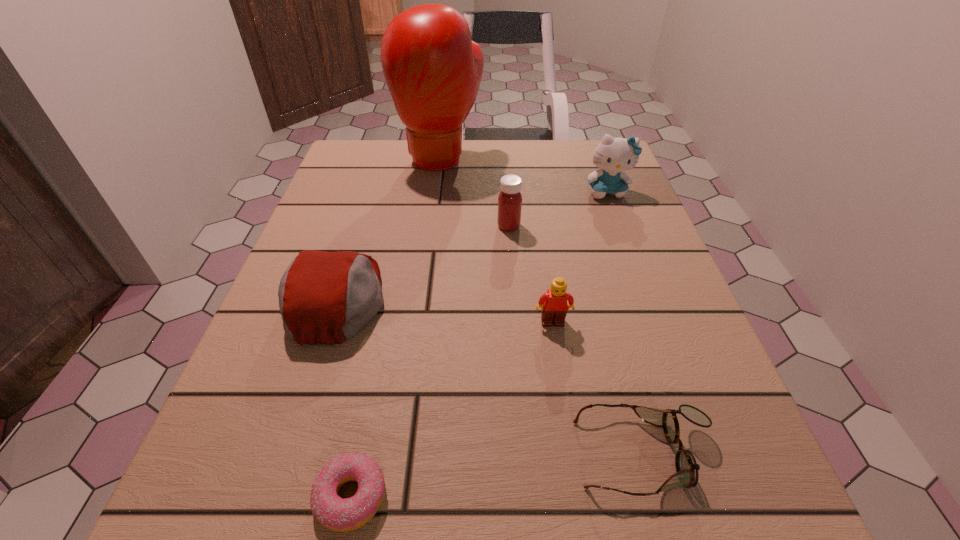
Locate an element on the screen. This screenshot has height=540, width=960. object that is at the far right corner is located at coordinates (613, 155).

You are a GUI agent. You are given a task and a screenshot of the screen. Output one action in this format:
    pyautogui.click(x=<x>, y=<y>)
    Task: Click on the object located at the near right corner
    
    Given the screenshot: What is the action you would take?
    pyautogui.click(x=687, y=469)

The height and width of the screenshot is (540, 960). In the image, there is a desktop. In order to click on vacant space at the far edge in this screenshot , I will do `click(534, 173)`.

Where is `free space at the left edge of the desktop`? Image resolution: width=960 pixels, height=540 pixels. free space at the left edge of the desktop is located at coordinates (x=267, y=324).

Find the location of a particular element. vacant space at the right edge of the desktop is located at coordinates (682, 323).

I want to click on vacant space at the far left corner of the desktop, so click(x=347, y=159).

In the image, there is a desktop. Where is `vacant space at the near left corner`? vacant space at the near left corner is located at coordinates (219, 497).

The height and width of the screenshot is (540, 960). I want to click on blank space at the far right corner of the desktop, so click(x=632, y=184).

Image resolution: width=960 pixels, height=540 pixels. What are the coordinates of `free space at the near right corner of the desktop` in the screenshot? It's located at (692, 488).

Locate an element on the screen. This screenshot has height=540, width=960. free space between the shortest object and the fourth object from right to left is located at coordinates (430, 361).